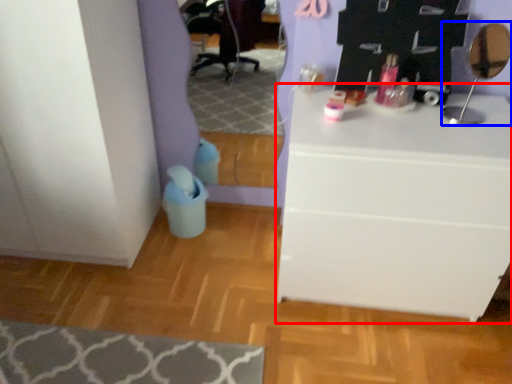
Question: Which point is closer to the camera, chest of drawers (highlighted by a red box) or mirror (highlighted by a blue box)?

Choices:
 (A) chest of drawers
 (B) mirror

Answer: (A)